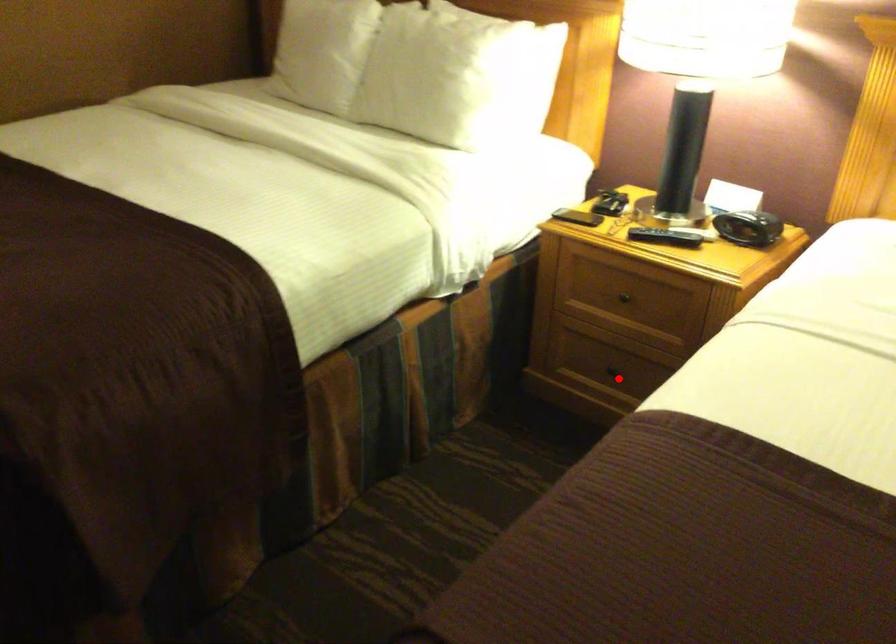
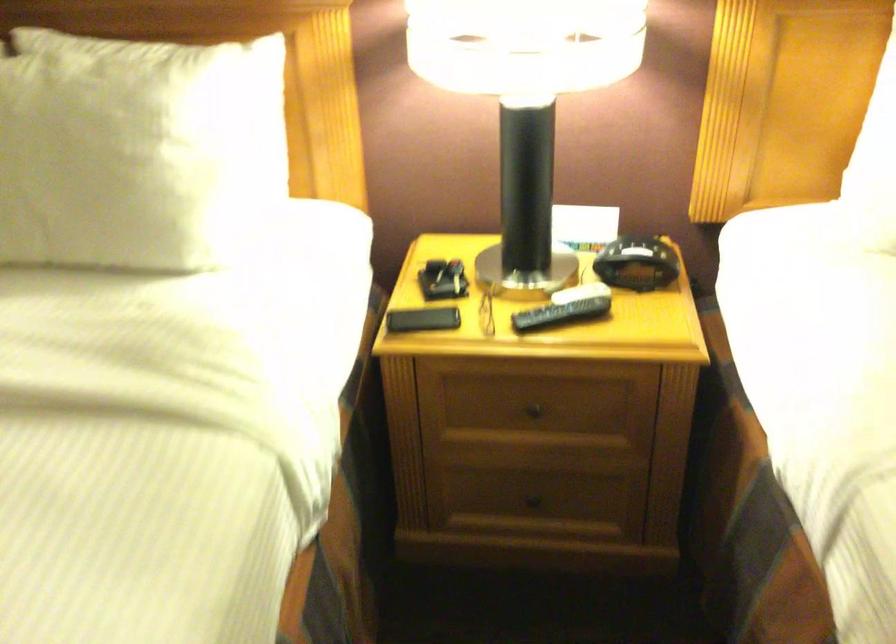
In the second image, find the point that corresponds to the highlighted location in the first image.

(538, 500)